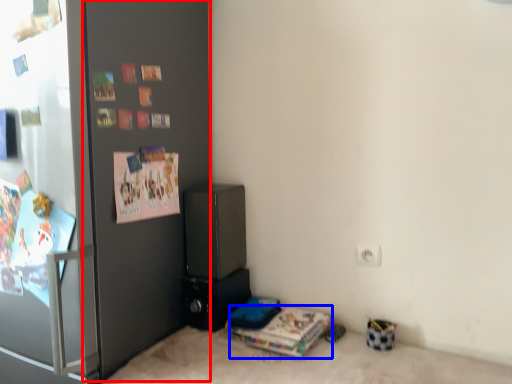
Question: Which of the following is the farthest to the observer, door (highlighted by a red box) or magazine (highlighted by a blue box)?

Choices:
 (A) door
 (B) magazine

Answer: (B)